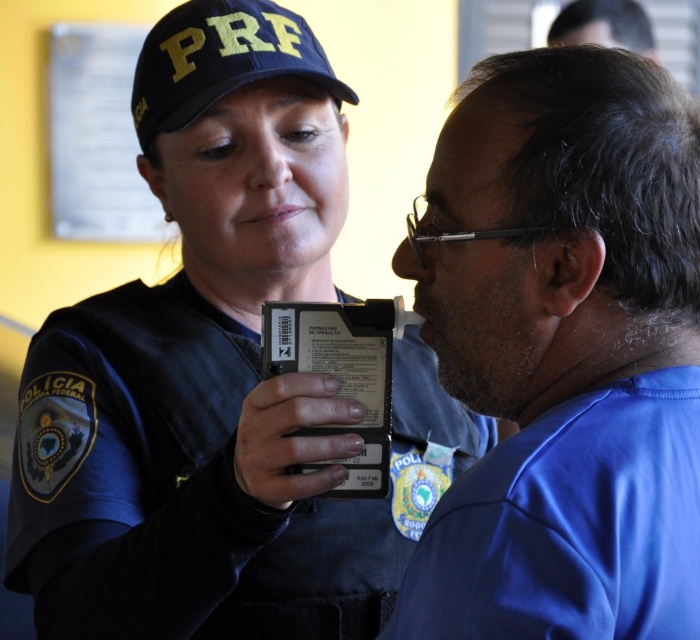
You are a witness observing the scene. You need to describe the relative positions of the blue fabric shirt at right and the black plastic card at center. Which object is positioned higher in the image?

The blue fabric shirt at right is taller than the black plastic card at center, so the blue fabric shirt at right is positioned higher in the image.

You are a police officer needing to determine if your black matte uniform at center can be stored in a locker that is the same width as dark brown hair at upper right. Based on the scene, can it fit?

The black matte uniform at center is wider than the dark brown hair at upper right, so it cannot fit into the locker with the same width as the dark brown hair at upper right.

You are a pedestrian standing near the officer and the person being tested. You need to cross the street but want to avoid walking between them. Which side should you choose to ensure you don not pass between the black matte uniform at center and the dark brown hair at upper right?

You should choose the side away from the dark brown hair at upper right because the black matte uniform at center is closer to you, so the space between them is narrower on that side. Walking on the side away from the dark brown hair at upper right will avoid passing between them.